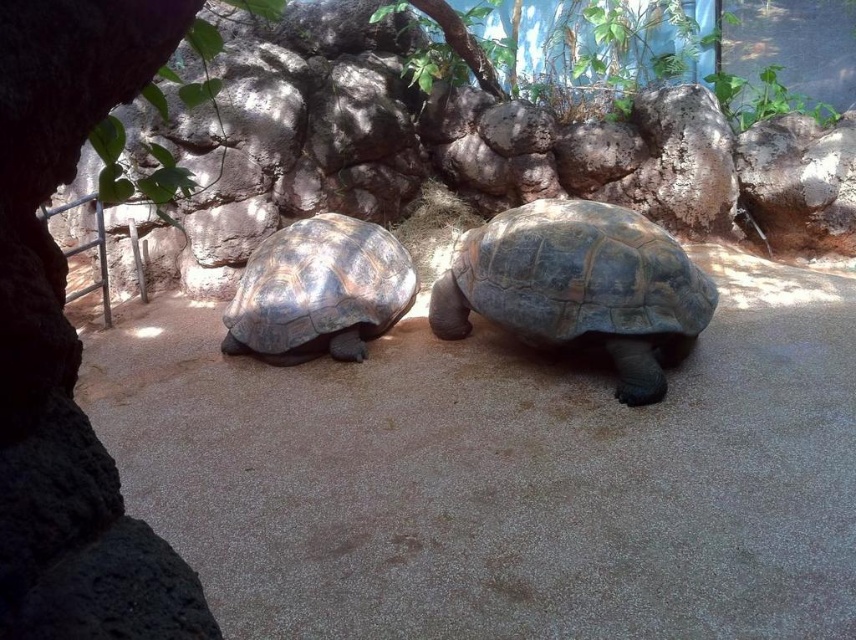
You are a zookeeper observing two tortoises in their enclosure. You notice a rough textured tortoise at center and a dark brown textured shell at center. Which tortoise has a taller height?

The rough textured tortoise at center is taller than the dark brown textured shell at center.

You are standing in front of the two tortoises in the image. You notice two specific points marked on the ground at coordinates point (611,259) and point (319,285). Which point is closer to you?

Point (611,259) is closer to the camera than point (319,285).